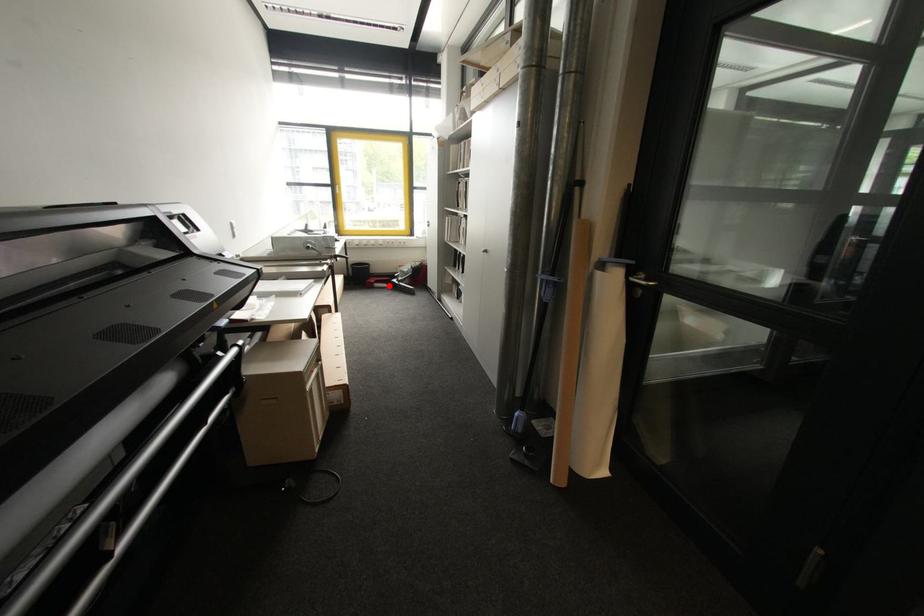
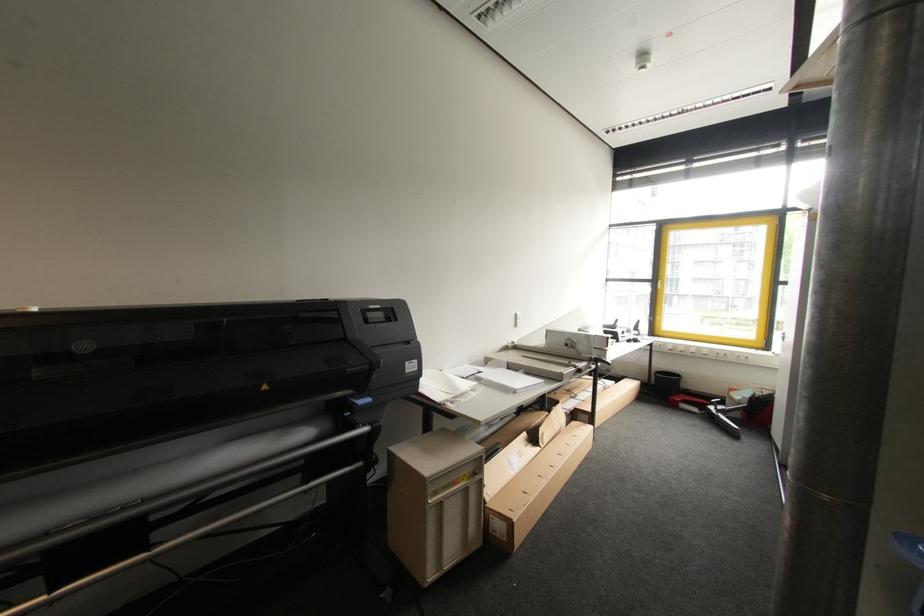
Locate, in the second image, the point that corresponds to the highlighted location in the first image.

(699, 411)